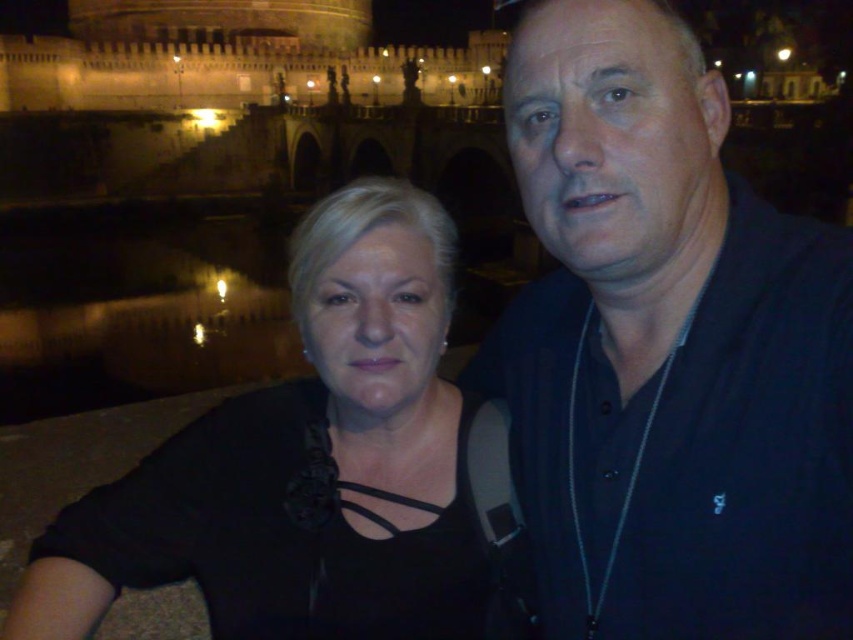
You are a photographer setting up for a group photo. You notice two people in the frame wearing a dark blue shirt at center and a black matte shirt at left. Based on their positions and clothing, which person is closer to the camera?

The dark blue shirt at center has a lesser width compared to the black matte shirt at left, indicating that the dark blue shirt at center is closer to the camera.

You are standing at the camera position taking a photo of the scene. There is a specific point at coordinates point (614, 396) that you want to focus on. Considering the distance between you and that point, would you need to adjust your camera settings for long distance focusing?

The distance between point (614, 396) and the camera is 51.27 meters. Since this is a long distance, you should adjust your camera settings for long distance focusing to ensure the point is in clear focus.

You are a photographer trying to capture a photo of the dark blue shirt at center and the black matte shirt at left. Based on their positions, which one is higher in the frame?

The dark blue shirt at center is located above the black matte shirt at left, so it is higher in the frame.